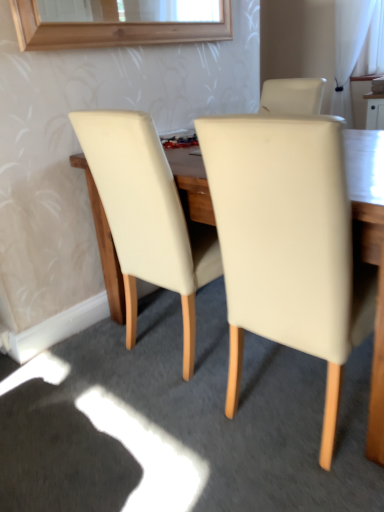
Describe the element at coordinates (147, 215) in the screenshot. This screenshot has width=384, height=512. I see `beige leather chair at center, which is counted as the 1th chair, starting from the left` at that location.

What do you see at coordinates (355, 48) in the screenshot? I see `white sheer curtain at upper right` at bounding box center [355, 48].

The image size is (384, 512). What are the coordinates of `beige leather chair at center, marked as the second chair in a left-to-right arrangement` in the screenshot? It's located at (288, 244).

Considering the sizes of white sheer curtain at upper right and beige leather chair at center, arranged as the 2th chair when viewed from the right, in the image, is white sheer curtain at upper right bigger or smaller than beige leather chair at center, arranged as the 2th chair when viewed from the right,?

white sheer curtain at upper right is smaller than beige leather chair at center, arranged as the 2th chair when viewed from the right.

Can you confirm if white sheer curtain at upper right is thinner than beige leather chair at center, arranged as the 2th chair when viewed from the right?

Yes.

The width and height of the screenshot is (384, 512). I want to click on the 1st chair below the white sheer curtain at upper right (from the image's perspective), so click(x=147, y=215).

Is point (327, 329) less distant than point (358, 35)?

Yes, it is.

Can you see beige leather chair at center, marked as the second chair in a left-to-right arrangement, touching white sheer curtain at upper right?

No.

Is beige leather chair at center, acting as the 1th chair starting from the right, wider or thinner than white sheer curtain at upper right?

Clearly, beige leather chair at center, acting as the 1th chair starting from the right, has more width compared to white sheer curtain at upper right.

Looking at this image, considering the relative positions of beige leather chair at center, acting as the 1th chair starting from the right, and white sheer curtain at upper right in the image provided, is beige leather chair at center, acting as the 1th chair starting from the right, to the left of white sheer curtain at upper right from the viewer's perspective?

Yes, beige leather chair at center, acting as the 1th chair starting from the right, is to the left of white sheer curtain at upper right.

Is point (281, 163) closer to viewer compared to point (103, 149)?

Yes, it is in front of point (103, 149).

Could you tell me if beige leather chair at center, acting as the 1th chair starting from the right, is turned towards beige leather chair at center, arranged as the 2th chair when viewed from the right?

Result: No, beige leather chair at center, acting as the 1th chair starting from the right, is not facing towards beige leather chair at center, arranged as the 2th chair when viewed from the right.

The height and width of the screenshot is (512, 384). I want to click on chair below the beige leather chair at center, arranged as the 2th chair when viewed from the right (from a real-world perspective), so click(x=288, y=244).

Is there a large distance between beige leather chair at center, marked as the second chair in a left-to-right arrangement, and beige leather chair at center, arranged as the 2th chair when viewed from the right?

beige leather chair at center, marked as the second chair in a left-to-right arrangement, is near beige leather chair at center, arranged as the 2th chair when viewed from the right, not far away.

Consider the image. From the image's perspective, which object appears higher, white sheer curtain at upper right or beige leather chair at center, marked as the second chair in a left-to-right arrangement?

white sheer curtain at upper right.

Is white sheer curtain at upper right smaller than beige leather chair at center, marked as the second chair in a left-to-right arrangement?

Indeed, white sheer curtain at upper right has a smaller size compared to beige leather chair at center, marked as the second chair in a left-to-right arrangement.

From a real-world perspective, which is physically above, white sheer curtain at upper right or beige leather chair at center, marked as the second chair in a left-to-right arrangement?

white sheer curtain at upper right, from a real-world perspective.

Which object is positioned more to the right, white sheer curtain at upper right or beige leather chair at center, acting as the 1th chair starting from the right?

From the viewer's perspective, white sheer curtain at upper right appears more on the right side.

From a real-world perspective, is beige leather chair at center, arranged as the 2th chair when viewed from the right, located higher than white sheer curtain at upper right?

Incorrect, from a real-world perspective, beige leather chair at center, arranged as the 2th chair when viewed from the right, is lower than white sheer curtain at upper right.

Is beige leather chair at center, which is counted as the 1th chair, starting from the left, bigger than white sheer curtain at upper right?

Yes, beige leather chair at center, which is counted as the 1th chair, starting from the left, is bigger than white sheer curtain at upper right.

Can you confirm if beige leather chair at center, arranged as the 2th chair when viewed from the right, is wider than white sheer curtain at upper right?

Correct, the width of beige leather chair at center, arranged as the 2th chair when viewed from the right, exceeds that of white sheer curtain at upper right.

Considering the points (201, 281) and (338, 18), which point is behind, point (201, 281) or point (338, 18)?

The point (338, 18) is farther from the camera.

Can you confirm if beige leather chair at center, which is counted as the 1th chair, starting from the left, is shorter than beige leather chair at center, marked as the second chair in a left-to-right arrangement?

Yes, beige leather chair at center, which is counted as the 1th chair, starting from the left, is shorter than beige leather chair at center, marked as the second chair in a left-to-right arrangement.

Is beige leather chair at center, arranged as the 2th chair when viewed from the right, aimed at beige leather chair at center, marked as the second chair in a left-to-right arrangement?

No, beige leather chair at center, arranged as the 2th chair when viewed from the right, is not aimed at beige leather chair at center, marked as the second chair in a left-to-right arrangement.

Considering the positions of point (172, 266) and point (227, 124), is point (172, 266) closer or farther from the camera than point (227, 124)?

Point (172, 266) appears to be farther away from the viewer than point (227, 124).

Identify the location of the 1st chair positioned below the white sheer curtain at upper right (from the image's perspective). (147, 215).

Where is `curtain behind the beige leather chair at center, marked as the second chair in a left-to-right arrangement`? The image size is (384, 512). curtain behind the beige leather chair at center, marked as the second chair in a left-to-right arrangement is located at coordinates (355, 48).

Based on their spatial positions, is beige leather chair at center, arranged as the 2th chair when viewed from the right, or beige leather chair at center, marked as the second chair in a left-to-right arrangement, closer to white sheer curtain at upper right?

The object closer to white sheer curtain at upper right is beige leather chair at center, arranged as the 2th chair when viewed from the right.

Which object lies nearer to the anchor point beige leather chair at center, acting as the 1th chair starting from the right, white sheer curtain at upper right or beige leather chair at center, which is counted as the 1th chair, starting from the left?

beige leather chair at center, which is counted as the 1th chair, starting from the left.

Based on their spatial positions, is white sheer curtain at upper right or beige leather chair at center, acting as the 1th chair starting from the right, further from beige leather chair at center, which is counted as the 1th chair, starting from the left?

white sheer curtain at upper right.

Estimate the real-world distances between objects in this image. Which object is further from beige leather chair at center, arranged as the 2th chair when viewed from the right, beige leather chair at center, acting as the 1th chair starting from the right, or white sheer curtain at upper right?

Answer: white sheer curtain at upper right is positioned further to the anchor beige leather chair at center, arranged as the 2th chair when viewed from the right.

From the image, which object appears to be nearer to white sheer curtain at upper right, beige leather chair at center, acting as the 1th chair starting from the right, or beige leather chair at center, which is counted as the 1th chair, starting from the left?

Among the two, beige leather chair at center, which is counted as the 1th chair, starting from the left, is located nearer to white sheer curtain at upper right.

Looking at the image, which one is located closer to beige leather chair at center, marked as the second chair in a left-to-right arrangement, beige leather chair at center, which is counted as the 1th chair, starting from the left, or white sheer curtain at upper right?

beige leather chair at center, which is counted as the 1th chair, starting from the left, is positioned closer to the anchor beige leather chair at center, marked as the second chair in a left-to-right arrangement.

In order to click on chair between beige leather chair at center, acting as the 1th chair starting from the right, and white sheer curtain at upper right in the front-back direction in this screenshot , I will do `click(147, 215)`.